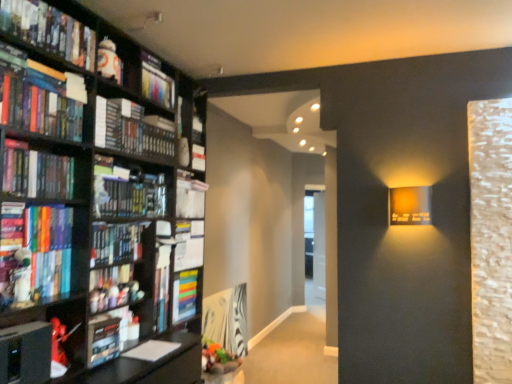
Question: Is hardcover book at left, the third book from the bottom, behind matte black book at left, the seventh book from the bottom?

Choices:
 (A) no
 (B) yes

Answer: (B)

Question: From a real-world perspective, does hardcover book at left, arranged as the 7th book when viewed from the top, stand above matte black book at left, the third book from the top?

Choices:
 (A) no
 (B) yes

Answer: (A)

Question: Is hardcover book at left, the third book from the bottom, oriented away from matte black book at left, the third book from the top?

Choices:
 (A) no
 (B) yes

Answer: (A)

Question: Does hardcover book at left, arranged as the 7th book when viewed from the top, have a greater width compared to matte black book at left, the third book from the top?

Choices:
 (A) yes
 (B) no

Answer: (A)

Question: Could you tell me if hardcover book at left, the third book from the bottom, is turned towards matte black book at left, the seventh book from the bottom?

Choices:
 (A) yes
 (B) no

Answer: (B)

Question: Based on their positions, is hardcover book at lower left, acting as the 9th book starting from the top, located to the left or right of white glossy figurine at upper left?

Choices:
 (A) right
 (B) left

Answer: (B)

Question: Is point (93, 347) positioned closer to the camera than point (122, 48)?

Choices:
 (A) farther
 (B) closer

Answer: (B)

Question: Looking at the image, does hardcover book at lower left, acting as the 9th book starting from the top, seem bigger or smaller compared to white glossy figurine at upper left?

Choices:
 (A) big
 (B) small

Answer: (A)

Question: Is hardcover book at lower left, acting as the 9th book starting from the top, wider or thinner than white glossy figurine at upper left?

Choices:
 (A) wide
 (B) thin

Answer: (A)

Question: Choose the correct answer: Is white matte bookshelf at upper left, the 5th book when ordered from bottom to top, inside matte black book at left, the third book from the top, or outside it?

Choices:
 (A) outside
 (B) inside

Answer: (A)

Question: In the image, is white matte bookshelf at upper left, the 5th book when ordered from bottom to top, positioned in front of or behind matte black book at left, the third book from the top?

Choices:
 (A) behind
 (B) front

Answer: (A)

Question: Is point (201, 168) positioned closer to the camera than point (51, 89)?

Choices:
 (A) farther
 (B) closer

Answer: (A)

Question: From the image's perspective, relative to matte black book at left, the third book from the top, is white matte bookshelf at upper left, the 5th book when ordered from bottom to top, above or below?

Choices:
 (A) below
 (B) above

Answer: (A)

Question: From a real-world perspective, is white matte bookshelf at upper left, the fifth book when ordered from top to bottom, above or below hardcover book at upper left, which ranks as the 1th book in top-to-bottom order?

Choices:
 (A) above
 (B) below

Answer: (B)

Question: In the image, is white matte bookshelf at upper left, the fifth book when ordered from top to bottom, positioned in front of or behind hardcover book at upper left, which ranks as the 1th book in top-to-bottom order?

Choices:
 (A) front
 (B) behind

Answer: (B)